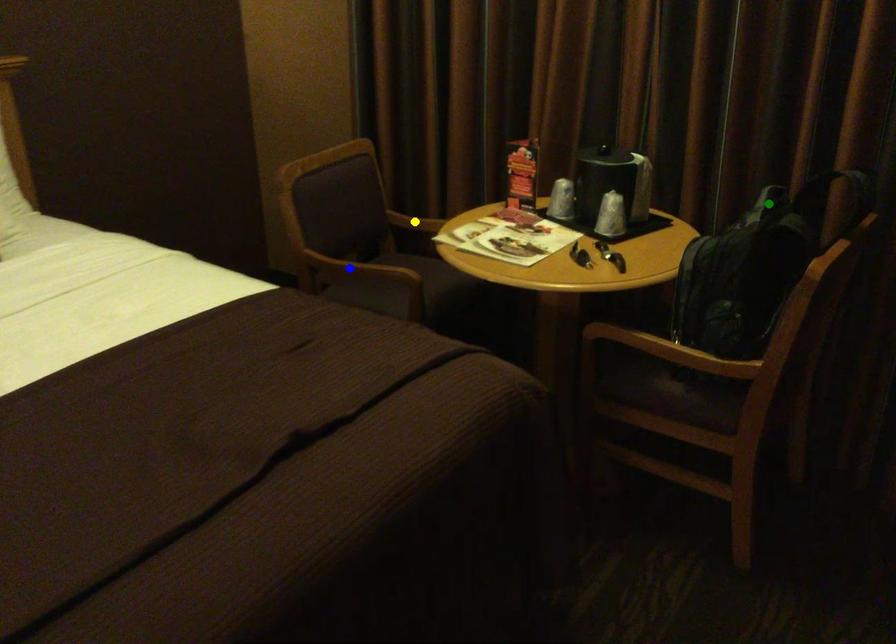
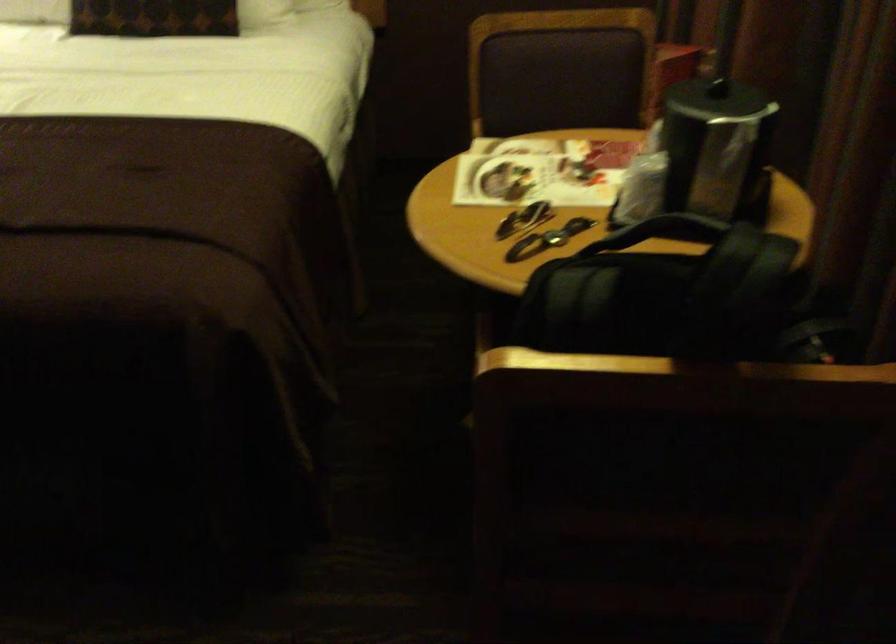
I am providing you with two images of the same scene from different viewpoints. Three points are marked in image1. Which point corresponds to a part or object that is occluded in image2?In image1, three points are marked. Which of them correspond to a part or object that is occluded in image2?Among the three points shown in image1, which one corresponds to a part or object that is no longer visible due to occlusion in image2?

blue point, yellow point